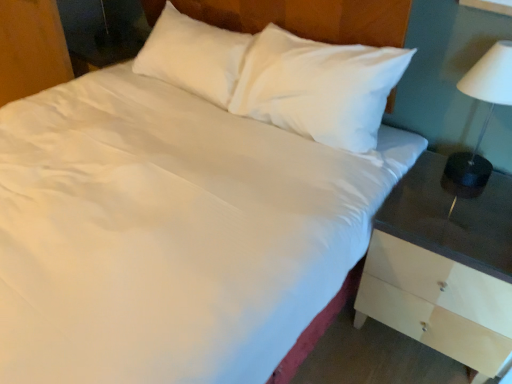
The width and height of the screenshot is (512, 384). I want to click on free spot above white wood nightstand at right (from a real-world perspective), so click(x=468, y=204).